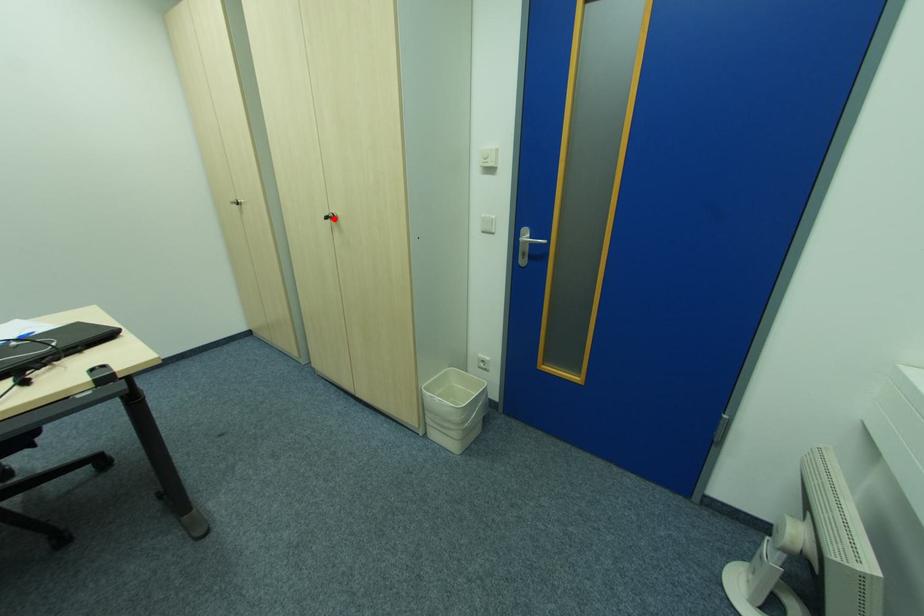
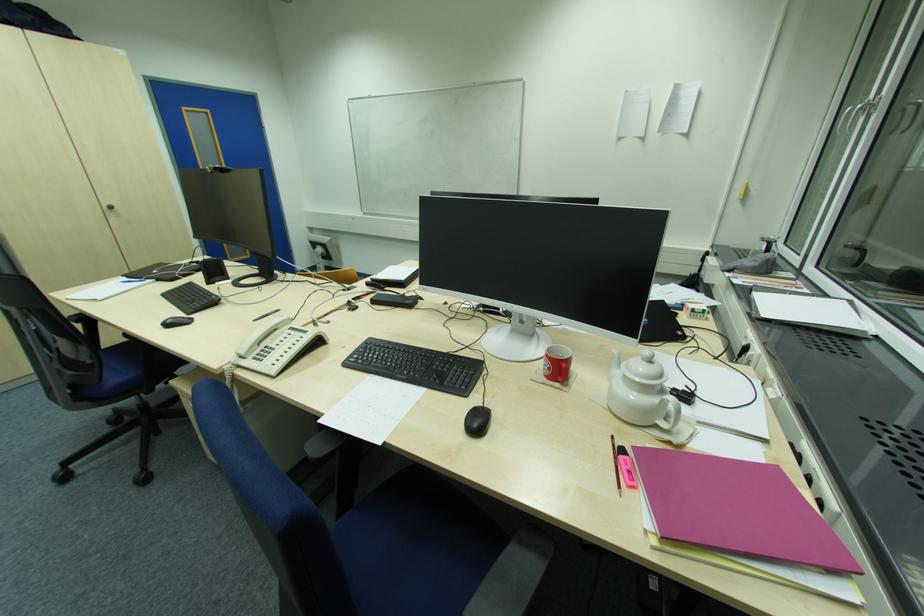
In the second image, find the point that corresponds to the highlighted location in the first image.

(114, 209)